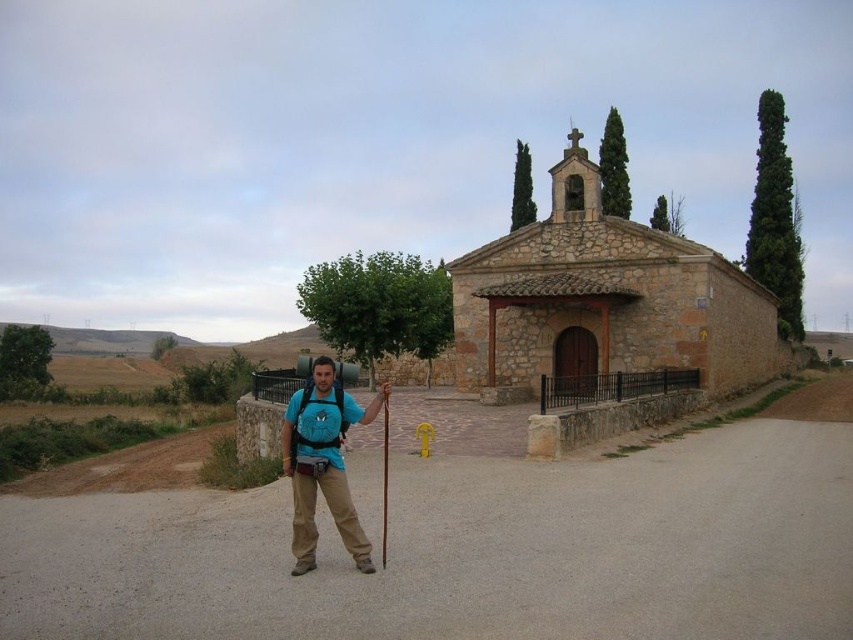
Can you confirm if brown stone church at center is positioned above blue fabric backpack at center?

Correct, brown stone church at center is located above blue fabric backpack at center.

Can you confirm if brown stone church at center is positioned to the left of blue fabric backpack at center?

In fact, brown stone church at center is to the right of blue fabric backpack at center.

Which is in front, point (703, 387) or point (293, 568)?

Point (293, 568) is in front.

Identify the location of brown stone church at center. (604, 300).

Find the location of `dirt track at center`. dirt track at center is located at coordinates (467, 552).

Does dirt track at center lie behind brown stone church at center?

No, dirt track at center is closer to the viewer.

Image resolution: width=853 pixels, height=640 pixels. What are the coordinates of `dirt track at center` in the screenshot? It's located at (467, 552).

This screenshot has width=853, height=640. In order to click on dirt track at center in this screenshot , I will do `click(467, 552)`.

Is dirt track at center shorter than blue fabric backpack at center?

Yes, dirt track at center is shorter than blue fabric backpack at center.

Between dirt track at center and blue fabric backpack at center, which one is positioned lower?

dirt track at center is below.

Locate an element on the screen. dirt track at center is located at coordinates (467, 552).